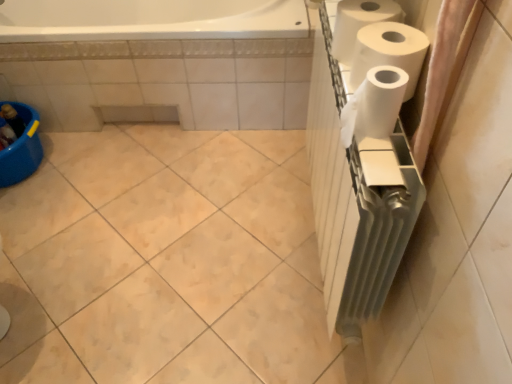
Question: Does pink fabric shower curtain at right turn towards white matte paper towel at upper right, placed as the third paper towel when sorted from front to back?

Choices:
 (A) no
 (B) yes

Answer: (A)

Question: Is pink fabric shower curtain at right further to the viewer compared to white matte paper towel at upper right, the first paper towel in the back-to-front sequence?

Choices:
 (A) no
 (B) yes

Answer: (A)

Question: Considering the relative sizes of pink fabric shower curtain at right and white matte paper towel at upper right, the first paper towel in the back-to-front sequence, in the image provided, is pink fabric shower curtain at right taller than white matte paper towel at upper right, the first paper towel in the back-to-front sequence,?

Choices:
 (A) yes
 (B) no

Answer: (A)

Question: Is pink fabric shower curtain at right outside of white matte paper towel at upper right, placed as the third paper towel when sorted from front to back?

Choices:
 (A) no
 (B) yes

Answer: (B)

Question: From the image's perspective, is pink fabric shower curtain at right on white matte paper towel at upper right, the first paper towel in the back-to-front sequence?

Choices:
 (A) no
 (B) yes

Answer: (A)

Question: From the image's perspective, is pink fabric shower curtain at right located beneath white matte paper towel at upper right, placed as the third paper towel when sorted from front to back?

Choices:
 (A) yes
 (B) no

Answer: (A)

Question: Are white matte paper towel at right, which is the 2th paper towel in front-to-back order, and white matte paper towel at upper right, placed as the third paper towel when sorted from front to back, far apart?

Choices:
 (A) yes
 (B) no

Answer: (B)

Question: Is white matte paper towel at right, which is the 2th paper towel in front-to-back order, at the left side of white matte paper towel at upper right, placed as the third paper towel when sorted from front to back?

Choices:
 (A) yes
 (B) no

Answer: (B)

Question: From a real-world perspective, does white matte paper towel at right, the second paper towel in the back-to-front sequence, stand above white matte paper towel at upper right, placed as the third paper towel when sorted from front to back?

Choices:
 (A) yes
 (B) no

Answer: (A)

Question: Considering the relative sizes of white matte paper towel at right, which is the 2th paper towel in front-to-back order, and white matte paper towel at upper right, placed as the third paper towel when sorted from front to back, in the image provided, is white matte paper towel at right, which is the 2th paper towel in front-to-back order, smaller than white matte paper towel at upper right, placed as the third paper towel when sorted from front to back,?

Choices:
 (A) yes
 (B) no

Answer: (B)

Question: From the image's perspective, is white matte paper towel at right, the second paper towel in the back-to-front sequence, located above white matte paper towel at upper right, placed as the third paper towel when sorted from front to back?

Choices:
 (A) yes
 (B) no

Answer: (B)

Question: Does white matte paper towel at right, which is the 2th paper towel in front-to-back order, have a greater height compared to white matte paper towel at upper right, the first paper towel in the back-to-front sequence?

Choices:
 (A) yes
 (B) no

Answer: (A)

Question: Is white matte paper towel at right, the third paper towel when ordered from back to front, touching white matte paper towel at right, which is the 2th paper towel in front-to-back order?

Choices:
 (A) no
 (B) yes

Answer: (B)